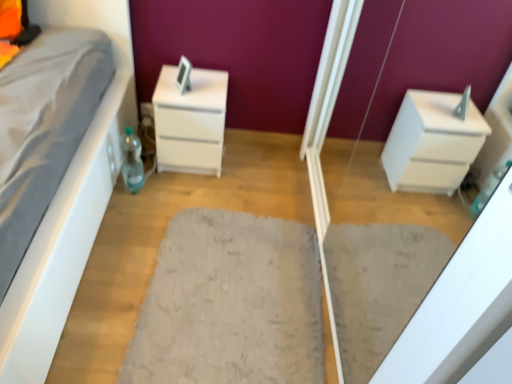
Question: Is white glossy chest of drawers at center at the left side of translucent plastic bottle at lower left?

Choices:
 (A) no
 (B) yes

Answer: (A)

Question: Is white glossy chest of drawers at center outside of translucent plastic bottle at lower left?

Choices:
 (A) no
 (B) yes

Answer: (B)

Question: Is white glossy chest of drawers at center turned away from translucent plastic bottle at lower left?

Choices:
 (A) no
 (B) yes

Answer: (A)

Question: From a real-world perspective, is white glossy chest of drawers at center below translucent plastic bottle at lower left?

Choices:
 (A) yes
 (B) no

Answer: (B)

Question: From the image's perspective, is white glossy chest of drawers at center on top of translucent plastic bottle at lower left?

Choices:
 (A) yes
 (B) no

Answer: (A)

Question: Is point (189, 291) positioned closer to the camera than point (123, 134)?

Choices:
 (A) closer
 (B) farther

Answer: (A)

Question: Is gray fluffy rug at center in front of or behind translucent plastic bottle at lower left in the image?

Choices:
 (A) behind
 (B) front

Answer: (B)

Question: From the image's perspective, is gray fluffy rug at center located above or below translucent plastic bottle at lower left?

Choices:
 (A) above
 (B) below

Answer: (B)

Question: Is gray fluffy rug at center situated inside translucent plastic bottle at lower left or outside?

Choices:
 (A) inside
 (B) outside

Answer: (B)

Question: From a real-world perspective, relative to white glossy drawer at right, is gray fluffy rug at center vertically above or below?

Choices:
 (A) above
 (B) below

Answer: (B)

Question: Considering their positions, is gray fluffy rug at center located in front of or behind white glossy drawer at right?

Choices:
 (A) behind
 (B) front

Answer: (A)

Question: Is gray fluffy rug at center inside the boundaries of white glossy drawer at right, or outside?

Choices:
 (A) outside
 (B) inside

Answer: (A)

Question: In the image, is gray fluffy rug at center on the left side or the right side of white glossy drawer at right?

Choices:
 (A) left
 (B) right

Answer: (A)

Question: Choose the correct answer: Is translucent plastic bottle at lower left inside white glossy chest of drawers at center or outside it?

Choices:
 (A) outside
 (B) inside

Answer: (A)

Question: Looking at their shapes, would you say translucent plastic bottle at lower left is wider or thinner than white glossy chest of drawers at center?

Choices:
 (A) thin
 (B) wide

Answer: (A)